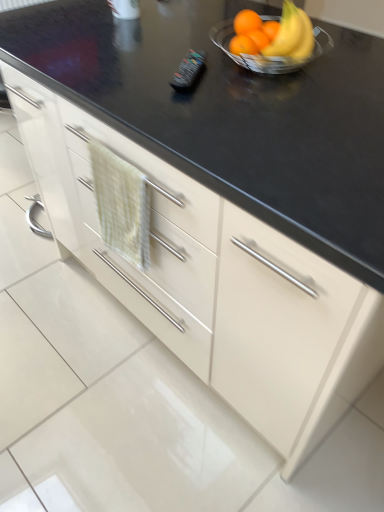
Image resolution: width=384 pixels, height=512 pixels. Identify the location of vacant region in front of orange matte at upper right. (265, 44).